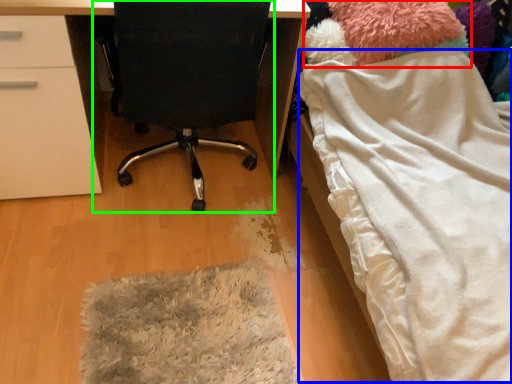
Question: Which object is the farthest from teddy (highlighted by a red box)? Choose among these: blanket (highlighted by a blue box) or chair (highlighted by a green box).

Choices:
 (A) blanket
 (B) chair

Answer: (B)